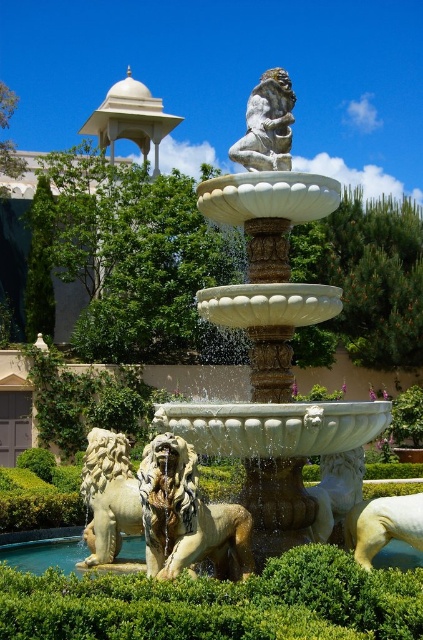
Can you confirm if beige marble gazebo at upper left is positioned to the left of white marble lion at lower right?

Yes, beige marble gazebo at upper left is to the left of white marble lion at lower right.

What do you see at coordinates (131, 118) in the screenshot?
I see `beige marble gazebo at upper left` at bounding box center [131, 118].

Does point (98, 134) come in front of point (365, 538)?

No.

Where is `beige marble gazebo at upper left`? The height and width of the screenshot is (640, 423). beige marble gazebo at upper left is located at coordinates (131, 118).

Between point (46, 168) and point (228, 508), which one is positioned in front?

Point (228, 508) is in front.

Who is shorter, green leafy bush at center or white marble lion at center?

With less height is white marble lion at center.

Locate an element on the screen. The image size is (423, 640). green leafy bush at center is located at coordinates (137, 257).

Is point (195, 472) positioned behind point (125, 122)?

No, it is in front of (125, 122).

Can you confirm if white marble lion at center is wider than beige marble gazebo at upper left?

No, white marble lion at center is not wider than beige marble gazebo at upper left.

Find the location of `white marble lion at center`. white marble lion at center is located at coordinates [186, 515].

Locate an element on the screen. The height and width of the screenshot is (640, 423). white marble lion at center is located at coordinates (186, 515).